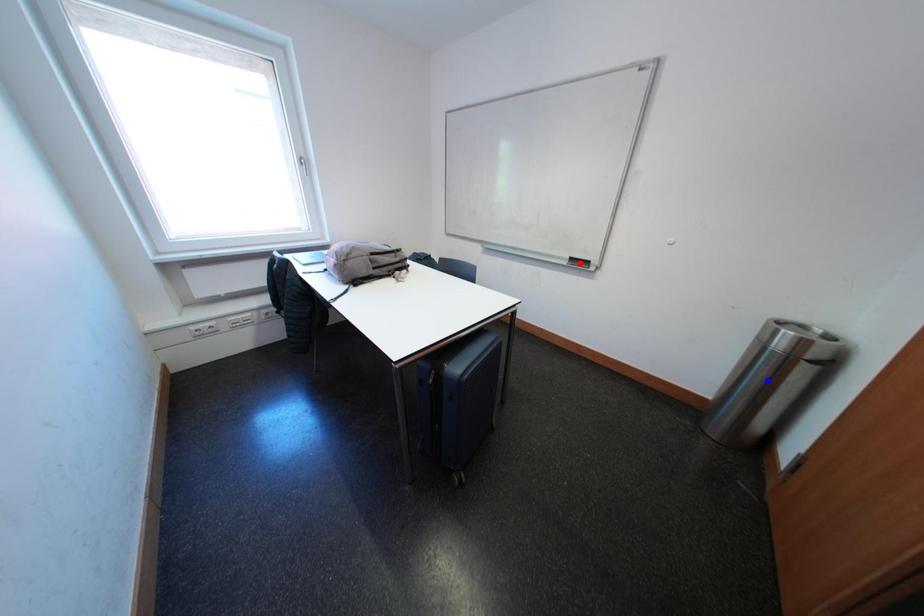
Question: Which of the two points in the image is closer to the camera?

Choices:
 (A) Blue point is closer.
 (B) Red point is closer.

Answer: (A)